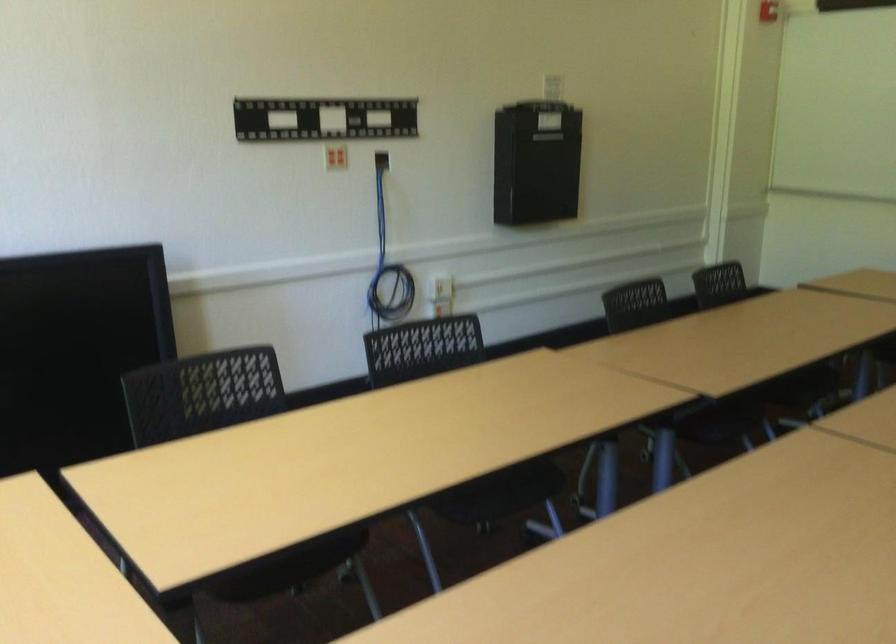
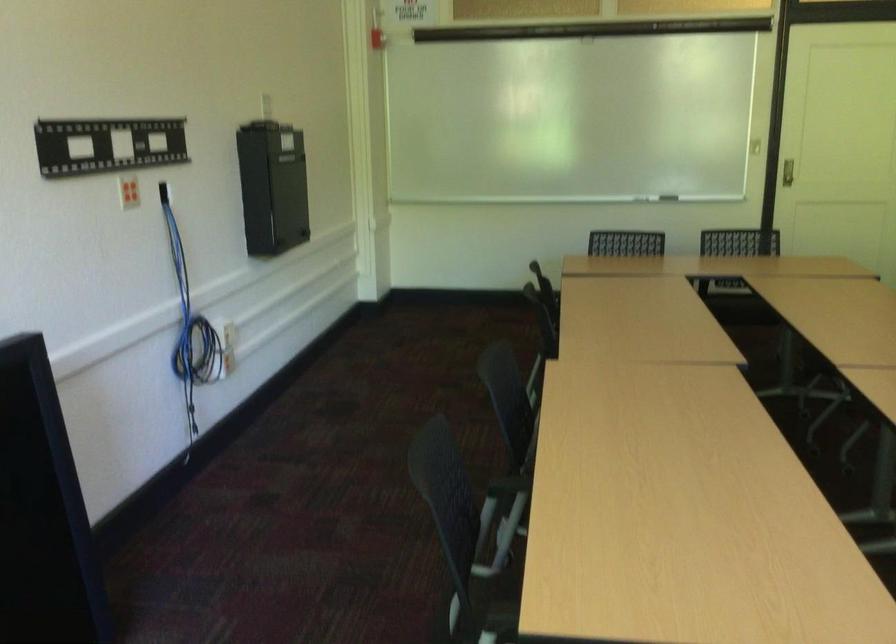
The point at (320, 421) is marked in the first image. Where is the corresponding point in the second image?

(506, 486)